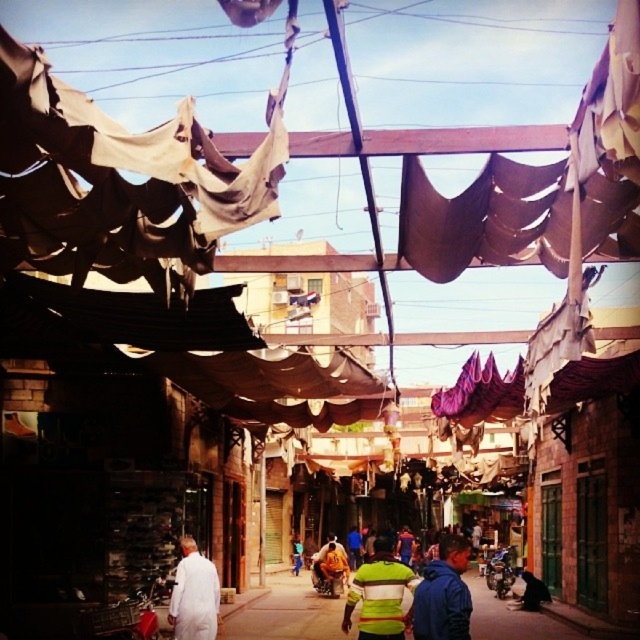
Between green jersey at center and blue fabric jacket at center, which one is positioned higher?

Positioned higher is blue fabric jacket at center.

The width and height of the screenshot is (640, 640). I want to click on green jersey at center, so click(x=380, y=595).

Which of these two, white matte clothing at center or white fabric at center, stands taller?

white fabric at center

Between white matte clothing at center and white fabric at center, which one appears on the right side from the viewer's perspective?

From the viewer's perspective, white fabric at center appears more on the right side.

Which is in front, point (212, 604) or point (292, 545)?

Point (212, 604) is in front.

The width and height of the screenshot is (640, 640). I want to click on white matte clothing at center, so click(193, 595).

Is blue fabric jacket at center further to the viewer compared to white fabric at center?

No, it is not.

Locate an element on the screen. Image resolution: width=640 pixels, height=640 pixels. blue fabric jacket at center is located at coordinates (444, 593).